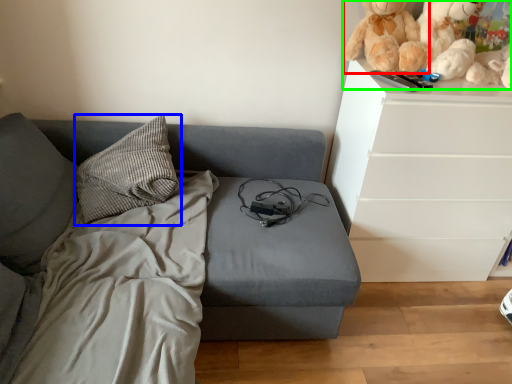
Question: Considering the real-world distances, which object is farthest from doll (highlighted by a red box)? pillow (highlighted by a blue box) or toy (highlighted by a green box)?

Choices:
 (A) pillow
 (B) toy

Answer: (A)